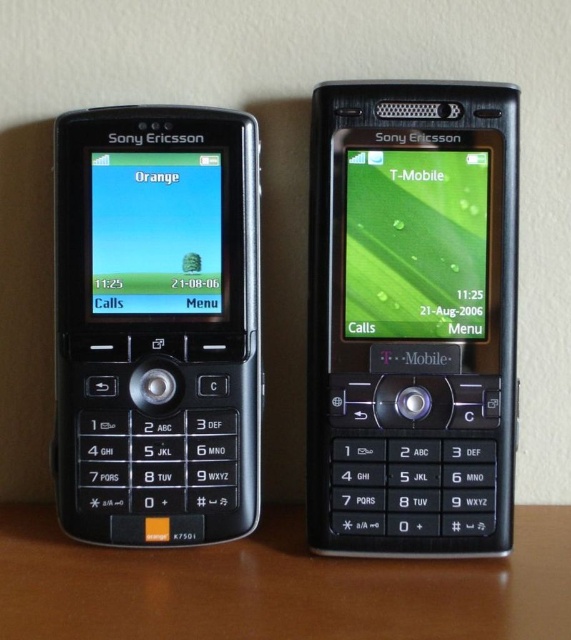
Question: Which object appears farthest from the camera in this image?

Choices:
 (A) black plastic sony ericsson at center
 (B) black plastic keypad at lower center

Answer: (A)

Question: Does black plastic sony ericsson at center have a greater width compared to black plastic keypad at lower center?

Choices:
 (A) no
 (B) yes

Answer: (A)

Question: Among these points, which one is farthest from the camera?

Choices:
 (A) (456, 109)
 (B) (431, 570)

Answer: (A)

Question: Which point is farther to the camera?

Choices:
 (A) (461, 586)
 (B) (392, 504)

Answer: (B)

Question: Does black plastic sony ericsson at center come in front of black plastic keypad at lower center?

Choices:
 (A) yes
 (B) no

Answer: (B)

Question: In this image, where is black plastic sony ericsson at center located relative to black plastic keypad at lower center?

Choices:
 (A) below
 (B) above

Answer: (B)